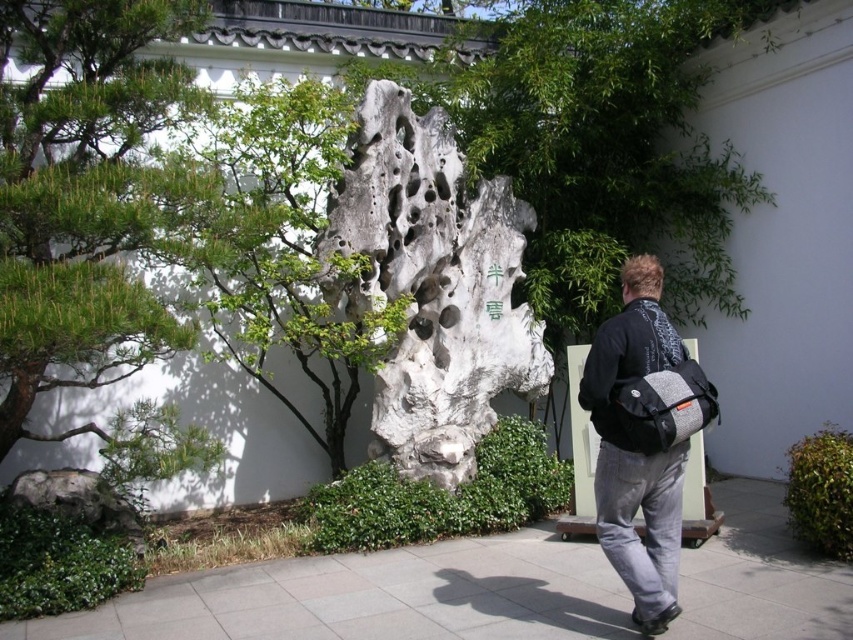
Question: Does green needle-like leaves at left have a lesser width compared to gray concrete pavement at center?

Choices:
 (A) no
 (B) yes

Answer: (A)

Question: Which point is closer to the camera?

Choices:
 (A) (714, 600)
 (B) (606, 364)
 (C) (386, 124)

Answer: (B)

Question: Is gray concrete pavement at center above dark gray fabric backpack at center right?

Choices:
 (A) no
 (B) yes

Answer: (A)

Question: Which object is farther from the camera taking this photo?

Choices:
 (A) white porous rock at center
 (B) green needle-like leaves at left

Answer: (A)

Question: Which of the following is the farthest from the observer?

Choices:
 (A) (22, 205)
 (B) (515, 93)

Answer: (B)

Question: Can you confirm if white porous rock at center is positioned below gray concrete pavement at center?

Choices:
 (A) no
 (B) yes

Answer: (A)